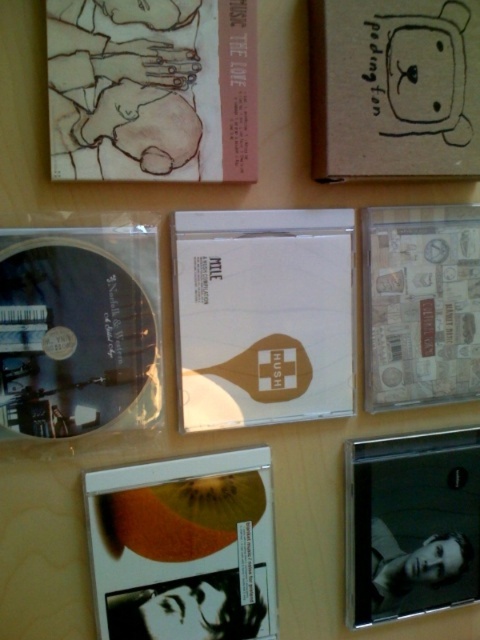
You are a photographer setting up a shot of the matte black album at upper left. The camera is positioned to capture the album clearly. If the album is currently 29.61 inches away from the camera, and you want to make it appear larger in the photo, should you move the camera closer to or farther away from the album?

To make the matte black album at upper left appear larger in the photo, you should move the camera closer to the album since decreasing the distance between the camera and the subject increases its size in the frame.

You are organizing a music collection and notice two CDs on the table. You need to place them into their respective slots. The white matte cd at center is to the right of transparent plastic cd at upper left. Which CD should you pick up first to maintain the order from left to right?

You should pick up the transparent plastic cd at upper left first because it is positioned to the left of the white matte cd at center, so moving from left to right, you should start with the transparent plastic cd at upper left before the white matte cd at center.